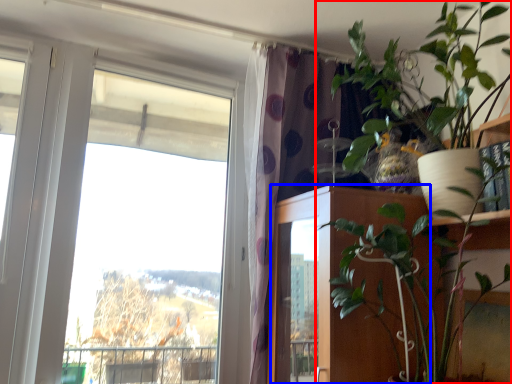
Question: Which object appears farthest to the camera in this image, houseplant (highlighted by a red box) or door (highlighted by a blue box)?

Choices:
 (A) houseplant
 (B) door

Answer: (B)